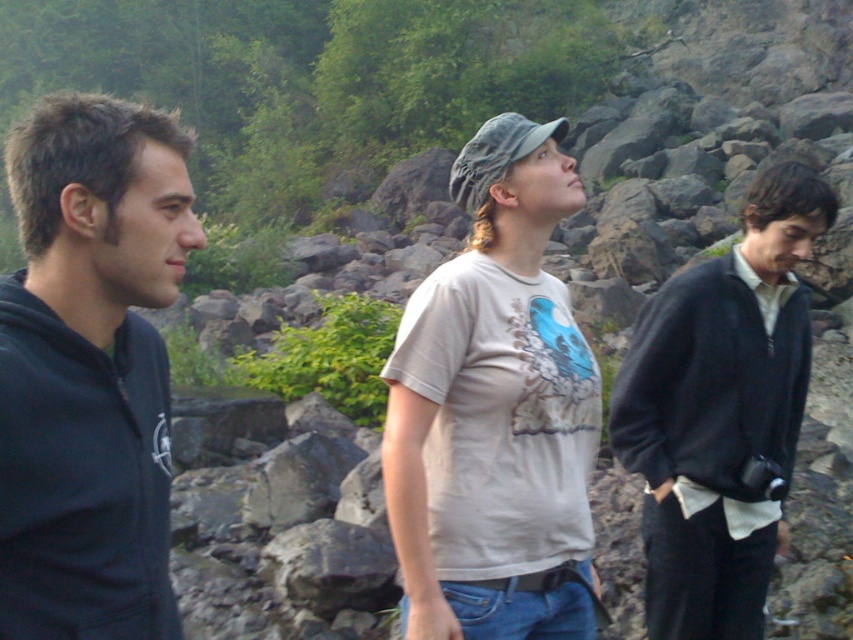
You are an observer standing in front of the three people. You need to determine which of the two individuals wearing dark blue clothing has a narrower width between the dark blue hoodie at left and the dark blue fleece at right.

The dark blue hoodie at left has a lesser width compared to the dark blue fleece at right, so the dark blue hoodie at left is narrower in width.